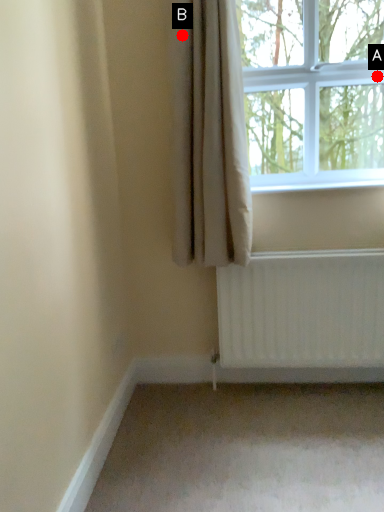
Question: Two points are circled on the image, labeled by A and B beside each circle. Which point is farther from the camera taking this photo?

Choices:
 (A) A is further
 (B) B is further

Answer: (A)